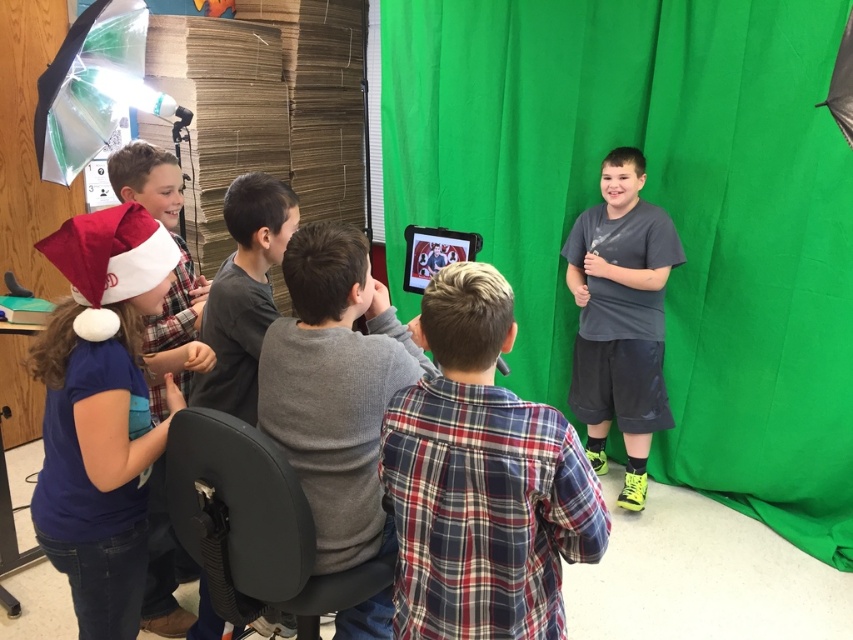
Is green fabric curtain at center further to camera compared to gray matte shirt at center?

Yes, it is behind gray matte shirt at center.

Does green fabric curtain at center have a larger size compared to gray matte shirt at center?

Yes, green fabric curtain at center is bigger than gray matte shirt at center.

The height and width of the screenshot is (640, 853). Describe the element at coordinates (659, 204) in the screenshot. I see `green fabric curtain at center` at that location.

The height and width of the screenshot is (640, 853). Identify the location of green fabric curtain at center. (659, 204).

Who is positioned more to the left, blue cotton shirt at left or plaid fabric shirt at left?

blue cotton shirt at left is more to the left.

Is blue cotton shirt at left closer to camera compared to plaid fabric shirt at left?

That is True.

Is point (134, 292) behind point (144, 326)?

That is False.

Where is `blue cotton shirt at left`? blue cotton shirt at left is located at coordinates [102, 412].

Can you confirm if green fabric curtain at center is bigger than blue cotton shirt at left?

Indeed, green fabric curtain at center has a larger size compared to blue cotton shirt at left.

Is point (824, 157) closer to viewer compared to point (59, 394)?

No, it is not.

Is point (590, 124) closer to viewer compared to point (119, 296)?

No.

At what (x,y) coordinates should I click in order to perform the action: click on green fabric curtain at center. Please return your answer as a coordinate pair (x, y). The width and height of the screenshot is (853, 640). Looking at the image, I should click on (659, 204).